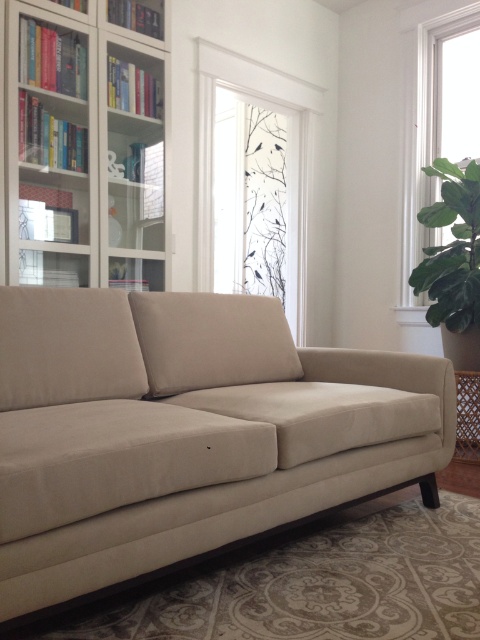
Question: Which of the following is the farthest from the observer?

Choices:
 (A) beige fabric couch at center
 (B) green leafy plant at right

Answer: (B)

Question: Is beige fabric pillow at center wider than green leafy plant at right?

Choices:
 (A) yes
 (B) no

Answer: (A)

Question: Which point is farther to the camera?

Choices:
 (A) transparent glass window at upper center
 (B) clear glass window at upper right
 (C) green leafy plant at right

Answer: (B)

Question: Which point appears farthest from the camera in this image?

Choices:
 (A) (145, 252)
 (B) (220, 305)
 (C) (479, 224)
 (D) (470, 45)

Answer: (D)

Question: Is white glossy bookcase at upper left positioned before beige fabric pillow at center?

Choices:
 (A) yes
 (B) no

Answer: (B)

Question: Is beige fabric pillow at center further to the viewer compared to green leafy plant at right?

Choices:
 (A) no
 (B) yes

Answer: (A)